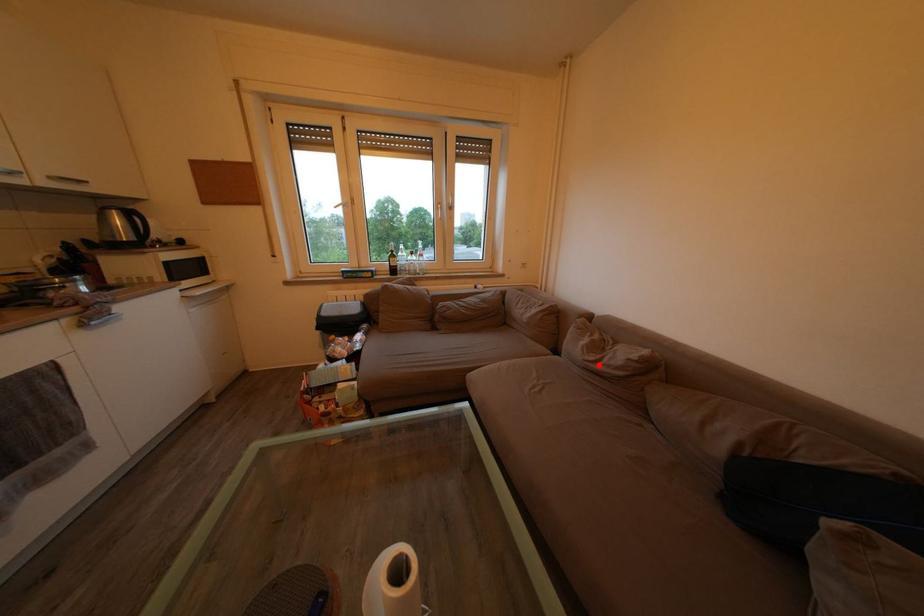
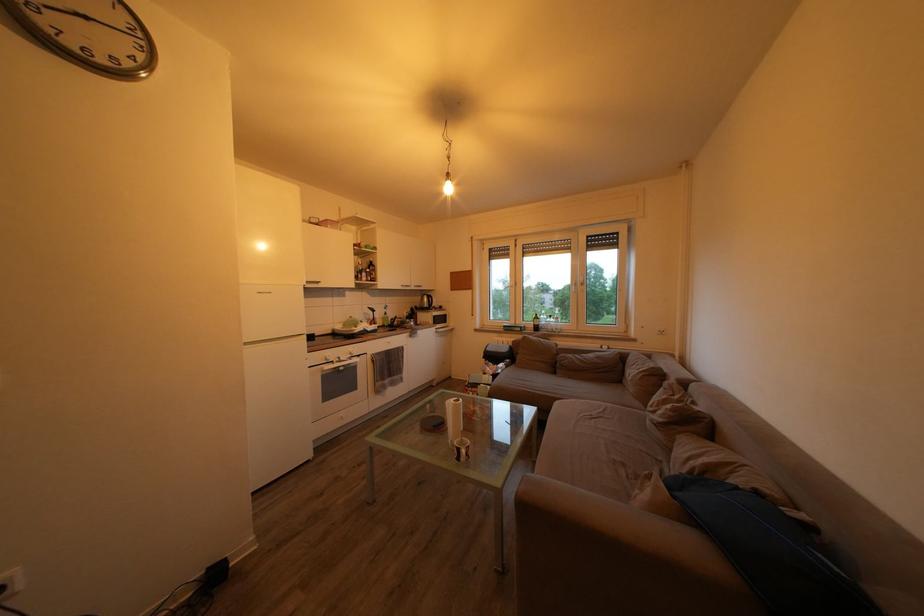
Question: A red point is marked in image1. In image2, is the corresponding 3D point closer to the camera or farther? Reply with the corresponding letter.

Choices:
 (A) The corresponding 3D point is closer.
 (B) The corresponding 3D point is farther.

Answer: (A)